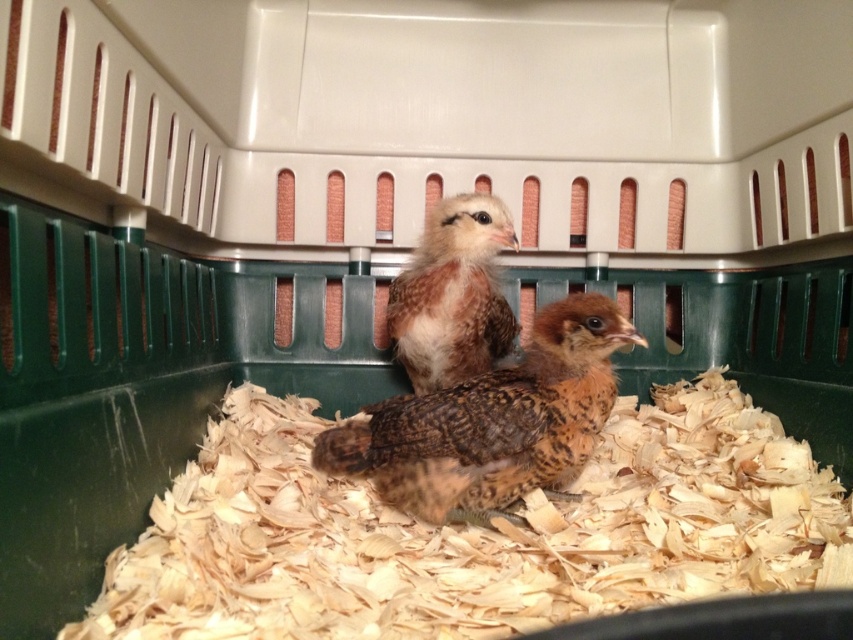
Question: From the image, what is the correct spatial relationship of brown speckled feathers at center in relation to brown speckled feather at center?

Choices:
 (A) below
 (B) above

Answer: (A)

Question: Can you confirm if brown speckled feathers at center is thinner than brown speckled feather at center?

Choices:
 (A) no
 (B) yes

Answer: (A)

Question: Which of the following is the closest to the observer?

Choices:
 (A) (573, 292)
 (B) (467, 259)

Answer: (B)

Question: Among these points, which one is farthest from the camera?

Choices:
 (A) (398, 337)
 (B) (467, 490)

Answer: (A)

Question: Which point is closer to the camera?

Choices:
 (A) brown speckled feather at center
 (B) brown speckled feathers at center

Answer: (B)

Question: Is brown speckled feathers at center further to camera compared to brown speckled feather at center?

Choices:
 (A) yes
 (B) no

Answer: (B)